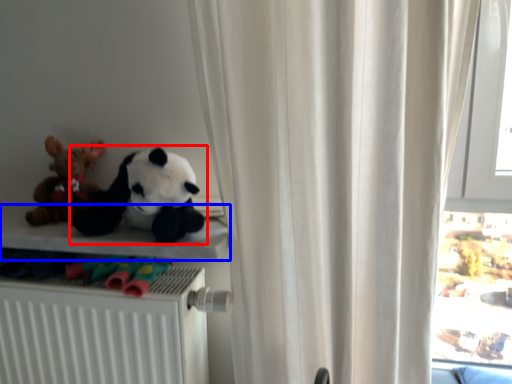
Question: Among these objects, which one is farthest to the camera, toy (highlighted by a red box) or shelf (highlighted by a blue box)?

Choices:
 (A) toy
 (B) shelf

Answer: (B)